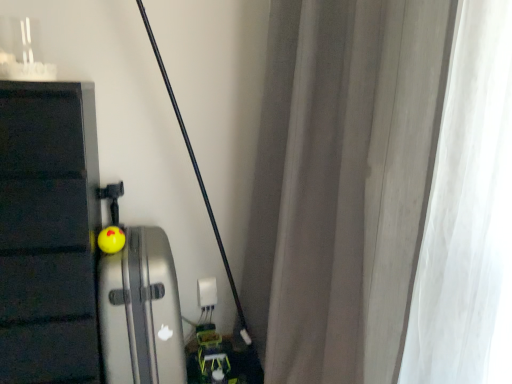
Question: Considering the positions of white plastic electric outlet at center and white sheer curtain at right in the image, is white plastic electric outlet at center taller or shorter than white sheer curtain at right?

Choices:
 (A) tall
 (B) short

Answer: (B)

Question: Considering the positions of white plastic electric outlet at center and white sheer curtain at right in the image, is white plastic electric outlet at center bigger or smaller than white sheer curtain at right?

Choices:
 (A) small
 (B) big

Answer: (A)

Question: Which object is the closest to the white plastic electric outlet at center?

Choices:
 (A) white sheer curtain at right
 (B) yellow rubber ball at center
 (C) silver metallic suitcase at left

Answer: (C)

Question: Considering the real-world distances, which object is farthest from the yellow rubber ball at center?

Choices:
 (A) white plastic electric outlet at center
 (B) white sheer curtain at right
 (C) silver metallic suitcase at left

Answer: (B)